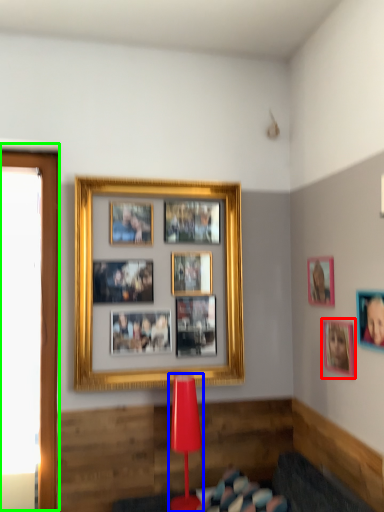
Question: Considering the real-world distances, which object is farthest from picture frame (highlighted by a red box)? table lamp (highlighted by a blue box) or window screen (highlighted by a green box)?

Choices:
 (A) table lamp
 (B) window screen

Answer: (B)